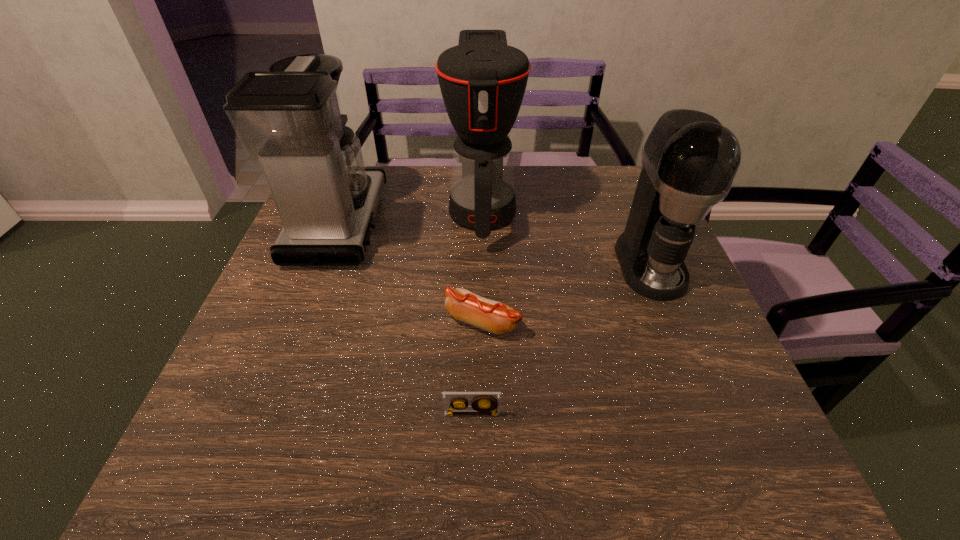
Locate an element on the screen. Image resolution: width=960 pixels, height=540 pixels. object that is at the left edge is located at coordinates (289, 118).

Find the location of `object that is at the right edge`. object that is at the right edge is located at coordinates (689, 160).

What are the coordinates of `object present at the far left corner` in the screenshot? It's located at (289, 118).

Identify the location of free region at the far edge of the desktop. (394, 202).

Identify the location of free space at the near edge of the desktop. This screenshot has width=960, height=540. (285, 479).

Where is `free space at the left edge of the desktop`? The height and width of the screenshot is (540, 960). free space at the left edge of the desktop is located at coordinates (297, 269).

Image resolution: width=960 pixels, height=540 pixels. Find the location of `vacant space that's between the sausage and the nearest object`. vacant space that's between the sausage and the nearest object is located at coordinates (477, 368).

This screenshot has height=540, width=960. Identify the location of vacant space in between the videotape and the fourth farthest object. (477, 368).

Find the location of a particular element. empty space between the videotape and the rightmost object is located at coordinates coord(561,339).

Where is `vacant area that lies between the sausage and the nearest object`? The height and width of the screenshot is (540, 960). vacant area that lies between the sausage and the nearest object is located at coordinates (477, 368).